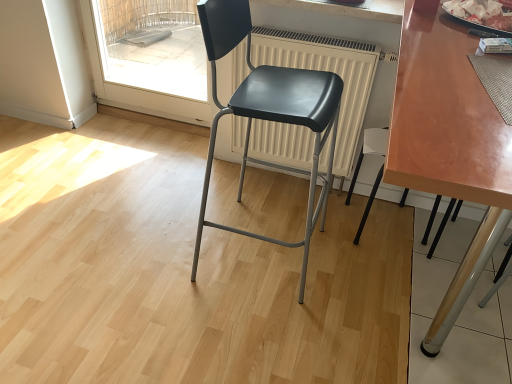
Locate an element on the screen. This screenshot has height=384, width=512. unoccupied space behind matte black chair at center, the second chair when ordered from right to left is located at coordinates click(243, 190).